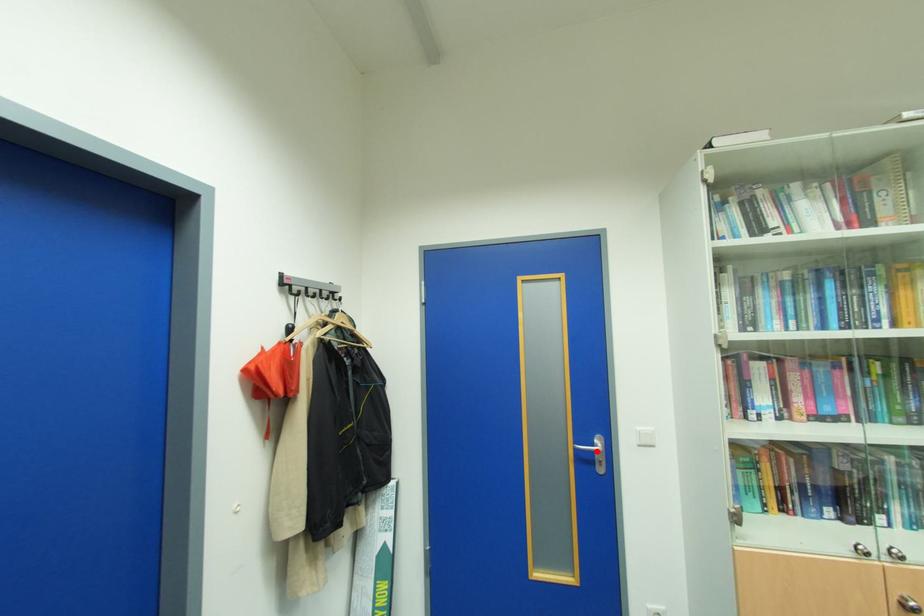
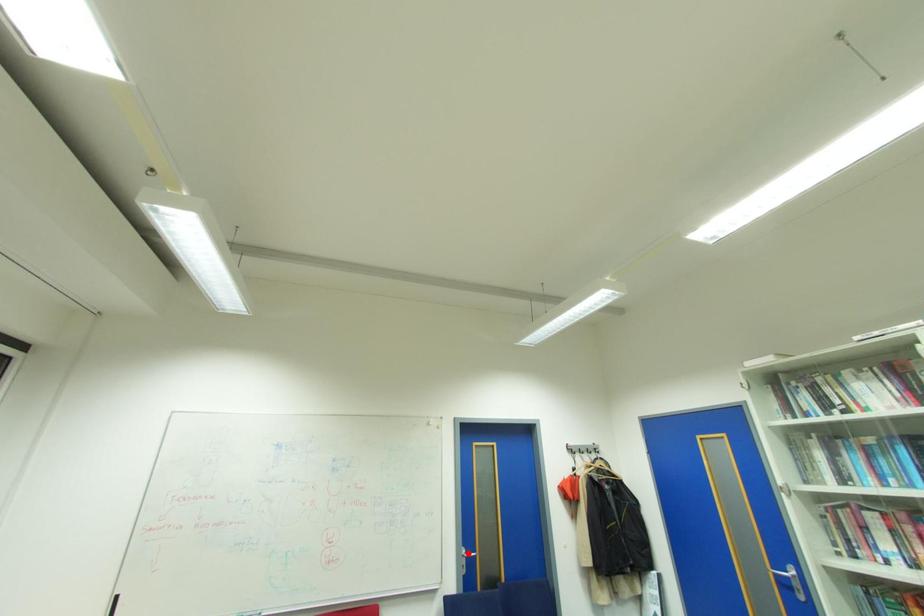
I am providing you with two images of the same scene from different viewpoints. A red point is marked on the first image and another point is marked on the second image. Do the highlighted points in image1 and image2 indicate the same real-world spot?

No